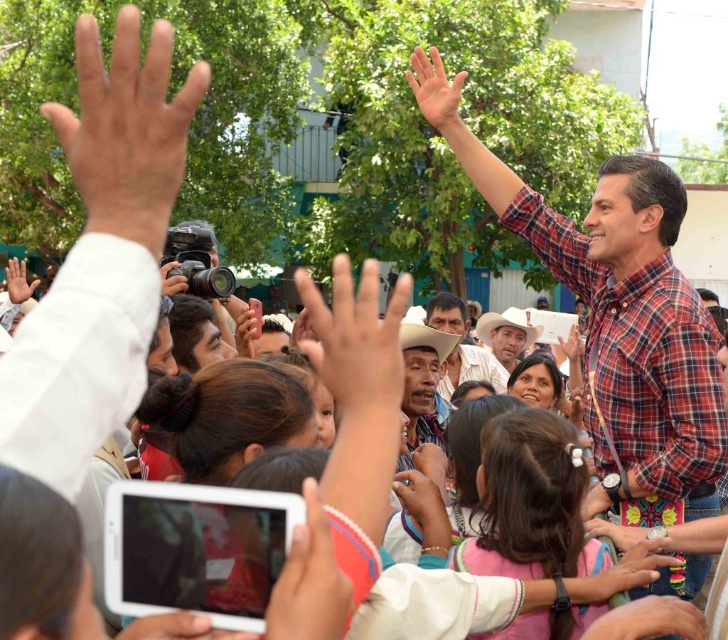
Question: Can you confirm if smooth white hand at center is positioned below matte black camera at center?

Choices:
 (A) yes
 (B) no

Answer: (A)

Question: In this image, where is white cowboy hat at center located relative to smooth skin hand at center?

Choices:
 (A) right
 (B) left

Answer: (A)

Question: Which object is farther from the camera taking this photo?

Choices:
 (A) plaid shirt at center
 (B) smooth white hand at center
 (C) matte skin hand at center
 (D) smooth skin hand at upper left

Answer: (A)

Question: Is plaid shirt at center positioned in front of light brown leather hat at center?

Choices:
 (A) no
 (B) yes

Answer: (B)

Question: Which object is farther from the camera taking this photo?

Choices:
 (A) light brown leather hat at center
 (B) skinny textured hand at upper center
 (C) matte plaid shirt at upper right
 (D) plaid shirt at center

Answer: (A)

Question: Which point is closer to the camera?

Choices:
 (A) (175, 289)
 (B) (290, 628)
 (C) (440, 70)
 (D) (515, 332)

Answer: (B)